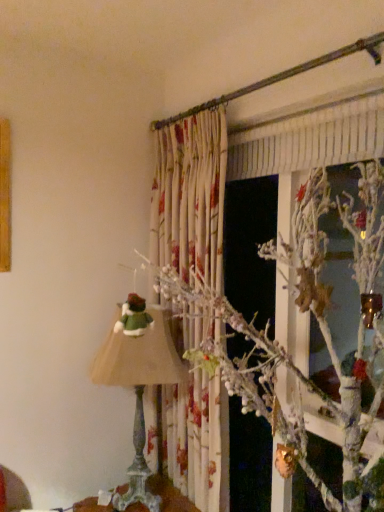
Question: Can you confirm if matte green fabric lampshade at left is positioned to the right of white frosted branch at upper center?

Choices:
 (A) yes
 (B) no

Answer: (B)

Question: Is matte green fabric lampshade at left located outside white frosted branch at upper center?

Choices:
 (A) yes
 (B) no

Answer: (A)

Question: Considering the relative sizes of matte green fabric lampshade at left and white frosted branch at upper center in the image provided, is matte green fabric lampshade at left smaller than white frosted branch at upper center?

Choices:
 (A) yes
 (B) no

Answer: (B)

Question: Is matte green fabric lampshade at left placed right next to white frosted branch at upper center?

Choices:
 (A) yes
 (B) no

Answer: (B)

Question: Considering the relative sizes of matte green fabric lampshade at left and white frosted branch at upper center in the image provided, is matte green fabric lampshade at left shorter than white frosted branch at upper center?

Choices:
 (A) yes
 (B) no

Answer: (B)

Question: Considering the relative positions of wooden table at lower center and white frosted branch at upper center in the image provided, is wooden table at lower center to the left or to the right of white frosted branch at upper center?

Choices:
 (A) right
 (B) left

Answer: (B)

Question: Is wooden table at lower center wider or thinner than white frosted branch at upper center?

Choices:
 (A) thin
 (B) wide

Answer: (B)

Question: Is wooden table at lower center inside or outside of white frosted branch at upper center?

Choices:
 (A) outside
 (B) inside

Answer: (A)

Question: In terms of size, does wooden table at lower center appear bigger or smaller than white frosted branch at upper center?

Choices:
 (A) small
 (B) big

Answer: (B)

Question: Considering their positions, is white frosted branch at upper center located in front of or behind wooden table at lower center?

Choices:
 (A) behind
 (B) front

Answer: (B)

Question: From a real-world perspective, is white frosted branch at upper center above or below wooden table at lower center?

Choices:
 (A) above
 (B) below

Answer: (A)

Question: Considering the positions of white frosted branch at upper center and wooden table at lower center in the image, is white frosted branch at upper center bigger or smaller than wooden table at lower center?

Choices:
 (A) big
 (B) small

Answer: (B)

Question: Considering the relative positions of white frosted branch at upper center and wooden table at lower center in the image provided, is white frosted branch at upper center to the left or to the right of wooden table at lower center?

Choices:
 (A) left
 (B) right

Answer: (B)

Question: Based on their positions, is matte green fabric lampshade at left located to the left or right of white frosted branch at upper center?

Choices:
 (A) right
 (B) left

Answer: (B)

Question: From a real-world perspective, relative to white frosted branch at upper center, is matte green fabric lampshade at left vertically above or below?

Choices:
 (A) below
 (B) above

Answer: (A)